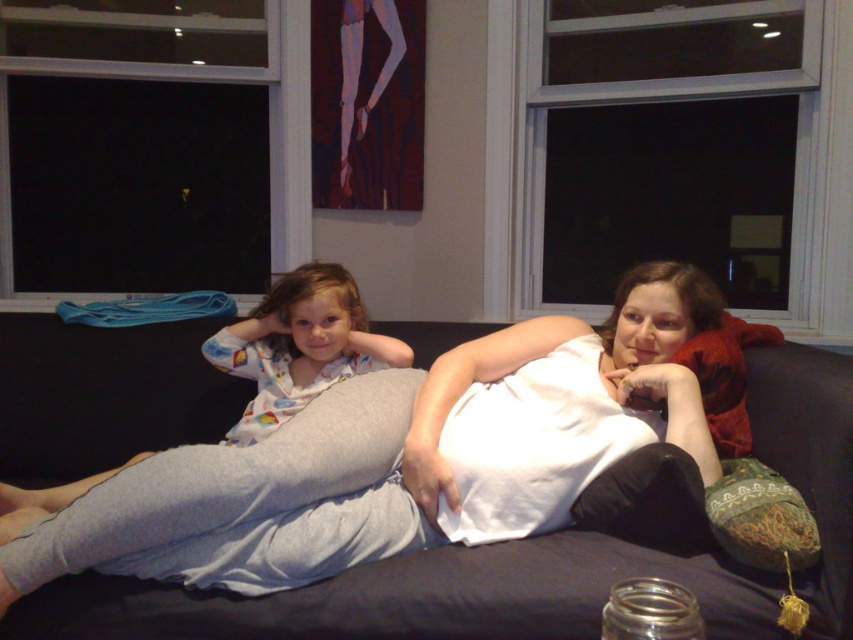
You are a photographer setting up a shoot in this living room. You need to place a small prop between the light gray cotton pajama pants at left and the white cotton pajamas at center. Where should you place it to ensure it is equidistant from both?

The light gray cotton pajama pants at left is closer to the viewer than the white cotton pajamas at center, so placing the prop halfway between them would require positioning it closer to the white cotton pajamas at center to maintain equal distance.

You are standing in the living room and want to place a small plant between the two points, point (567, 589) and point (267, 396). Which point should the plant be closer to so it is in front of the other point?

The plant should be placed closer to point (567, 589) because it is in front of point (267, 396).